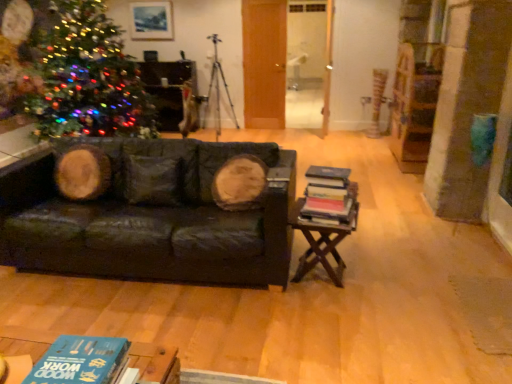
The image size is (512, 384). Identify the location of free space in front of dark green leather couch at center. (172, 326).